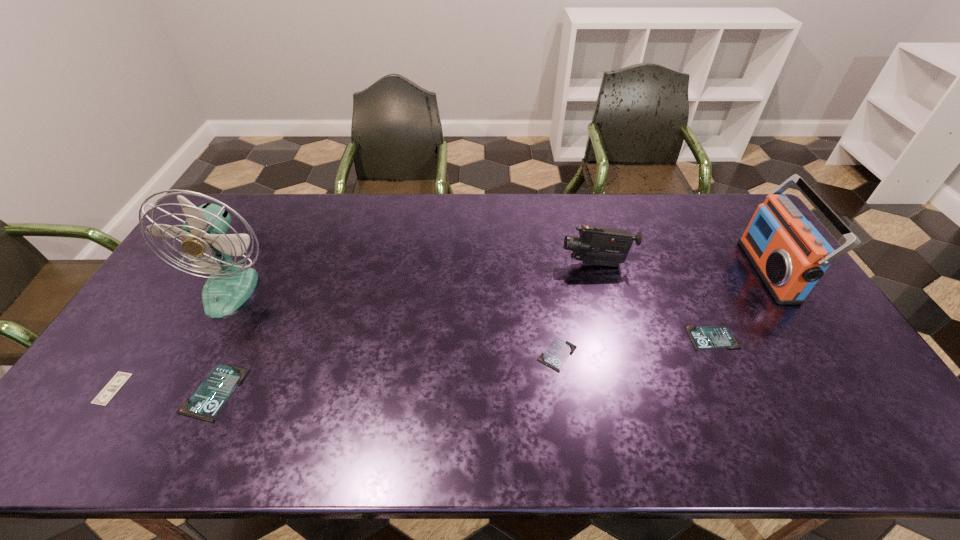
What are the coordinates of `the tallest identity card` in the screenshot? It's located at (210, 396).

Image resolution: width=960 pixels, height=540 pixels. I want to click on the fourth shortest object, so click(x=210, y=396).

Identify the location of the second shortest object. (556, 354).

Where is `the second identity card from left to right`? This screenshot has height=540, width=960. the second identity card from left to right is located at coordinates (556, 354).

The image size is (960, 540). In order to click on the rightmost identity card in this screenshot , I will do `click(702, 337)`.

This screenshot has height=540, width=960. I want to click on the second shortest identity card, so click(702, 337).

Locate an element on the screen. The width and height of the screenshot is (960, 540). the fifth shortest object is located at coordinates (596, 245).

Where is `fan`? This screenshot has width=960, height=540. fan is located at coordinates (230, 284).

Identify the location of the sixth shortest object. This screenshot has width=960, height=540. (789, 254).

Image resolution: width=960 pixels, height=540 pixels. In order to click on the rightmost object in this screenshot , I will do `click(789, 254)`.